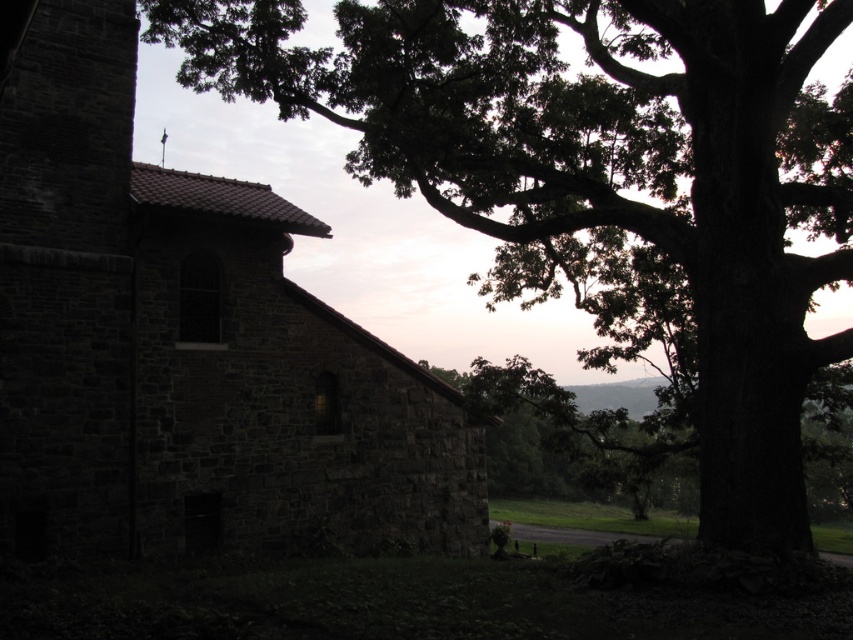
Can you confirm if dark green leafy tree at upper right is thinner than dark stone church at left?

No, dark green leafy tree at upper right is not thinner than dark stone church at left.

Is dark green leafy tree at upper right further to the viewer compared to dark stone church at left?

Yes, dark green leafy tree at upper right is further from the viewer.

What do you see at coordinates (602, 179) in the screenshot?
I see `dark green leafy tree at upper right` at bounding box center [602, 179].

Find the location of a particular element. dark green leafy tree at upper right is located at coordinates (602, 179).